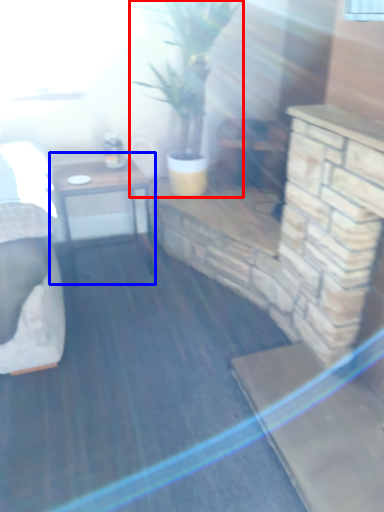
Question: Which of the following is the closest to the observer, houseplant (highlighted by a red box) or table (highlighted by a blue box)?

Choices:
 (A) houseplant
 (B) table

Answer: (A)